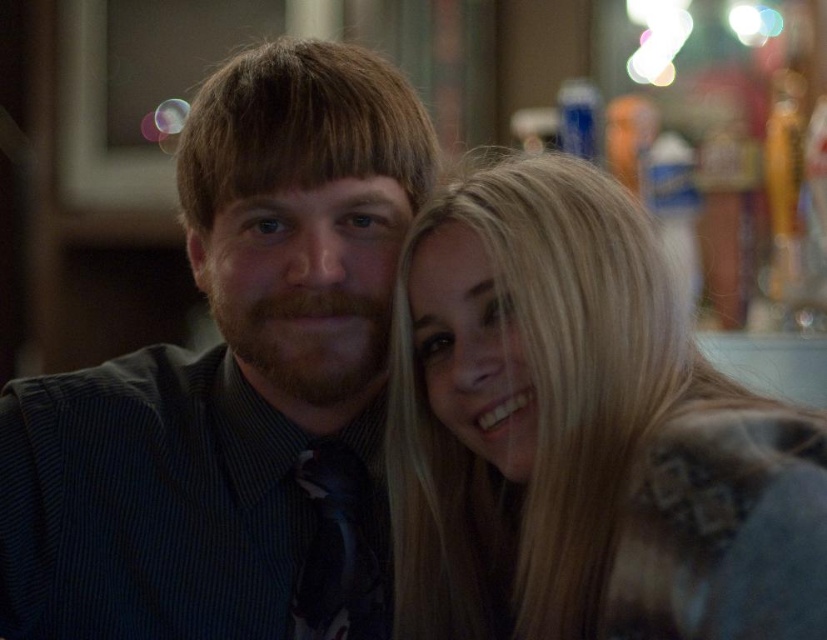
Who is more forward, (249, 216) or (355, 540)?

Positioned in front is point (249, 216).

The height and width of the screenshot is (640, 827). In order to click on matte black shirt at center in this screenshot , I will do coord(233,385).

Can you confirm if blonde hair at upper right is thinner than matte black tie at center?

In fact, blonde hair at upper right might be wider than matte black tie at center.

Between point (447, 228) and point (299, 636), which one is positioned in front?

Point (447, 228)

Is point (531, 305) positioned behind point (349, 490)?

That is False.

The height and width of the screenshot is (640, 827). In order to click on blonde hair at upper right in this screenshot , I will do `click(582, 435)`.

Who is more distant from viewer, (187,205) or (438,284)?

The point (187,205) is more distant.

Which is more to the right, matte black shirt at center or blonde hair at upper right?

blonde hair at upper right is more to the right.

The height and width of the screenshot is (640, 827). What do you see at coordinates (233, 385) in the screenshot?
I see `matte black shirt at center` at bounding box center [233, 385].

You are a GUI agent. You are given a task and a screenshot of the screen. Output one action in this format:
    pyautogui.click(x=<x>, y=<y>)
    Task: Click on the matte black shirt at center
    This screenshot has width=827, height=640.
    Given the screenshot: What is the action you would take?
    pyautogui.click(x=233, y=385)